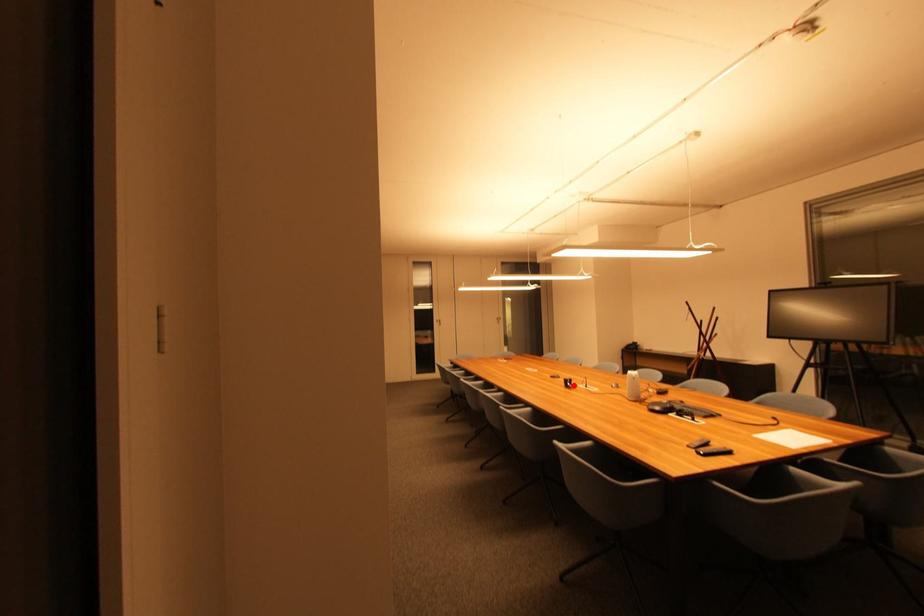
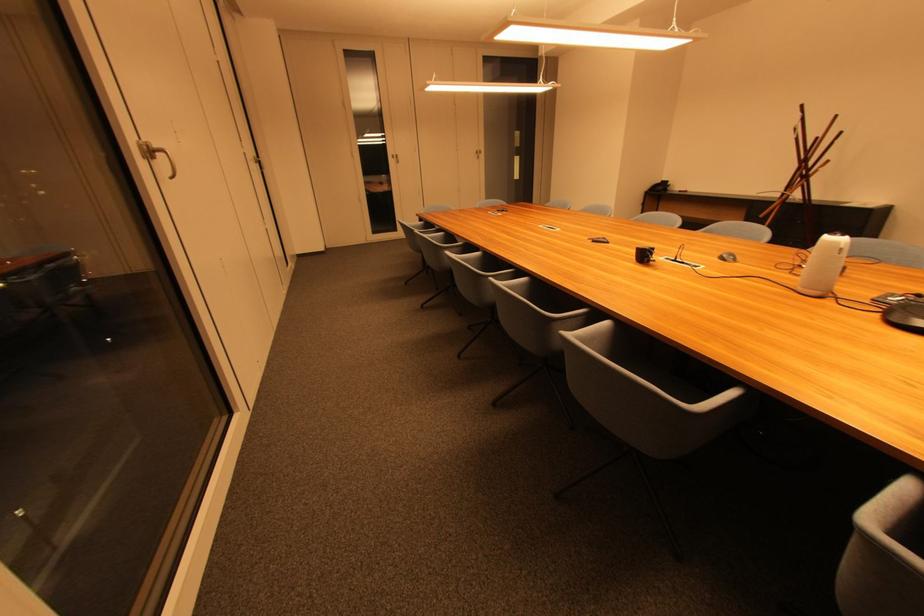
Where in the second image is the point corresponding to the highlighted location from the first image?

(649, 257)